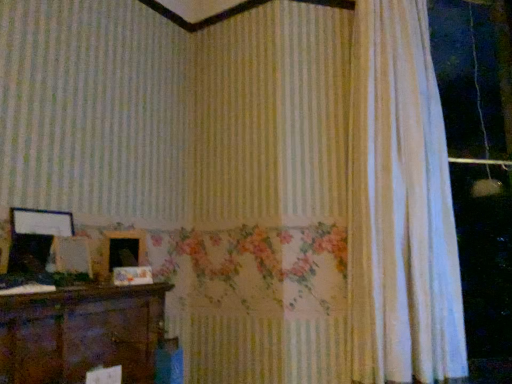
Question: Is wooden picture frame at center, positioned as the 2th picture frame in left-to-right order, not inside white sheer curtain at right?

Choices:
 (A) yes
 (B) no

Answer: (A)

Question: From the image's perspective, is wooden picture frame at center, the 1th picture frame from the right, located beneath white sheer curtain at right?

Choices:
 (A) no
 (B) yes

Answer: (B)

Question: Is wooden picture frame at center, positioned as the 2th picture frame in left-to-right order, positioned in front of white sheer curtain at right?

Choices:
 (A) no
 (B) yes

Answer: (B)

Question: Does wooden picture frame at center, positioned as the 2th picture frame in left-to-right order, have a smaller size compared to white sheer curtain at right?

Choices:
 (A) yes
 (B) no

Answer: (A)

Question: Could you tell me if wooden picture frame at center, the 1th picture frame from the right, is facing white sheer curtain at right?

Choices:
 (A) no
 (B) yes

Answer: (A)

Question: Is wooden picture frame at center, the 1th picture frame from the right, shorter than white sheer curtain at right?

Choices:
 (A) no
 (B) yes

Answer: (B)

Question: Is wooden picture frame at left, which appears as the 2th picture frame when viewed from the right, looking in the opposite direction of white sheer curtain at right?

Choices:
 (A) no
 (B) yes

Answer: (A)

Question: Does wooden picture frame at left, acting as the 1th picture frame starting from the left, have a lesser width compared to white sheer curtain at right?

Choices:
 (A) no
 (B) yes

Answer: (B)

Question: Is wooden picture frame at left, acting as the 1th picture frame starting from the left, in front of white sheer curtain at right?

Choices:
 (A) no
 (B) yes

Answer: (B)

Question: Is wooden picture frame at left, acting as the 1th picture frame starting from the left, next to white sheer curtain at right?

Choices:
 (A) no
 (B) yes

Answer: (A)

Question: Are wooden picture frame at left, which appears as the 2th picture frame when viewed from the right, and white sheer curtain at right located far from each other?

Choices:
 (A) yes
 (B) no

Answer: (A)

Question: Considering the relative positions of wooden picture frame at left, which appears as the 2th picture frame when viewed from the right, and white sheer curtain at right in the image provided, is wooden picture frame at left, which appears as the 2th picture frame when viewed from the right, to the left of white sheer curtain at right from the viewer's perspective?

Choices:
 (A) no
 (B) yes

Answer: (B)

Question: Considering the relative positions of wooden picture frame at left, which appears as the 2th picture frame when viewed from the right, and wooden picture frame at center, positioned as the 2th picture frame in left-to-right order, in the image provided, is wooden picture frame at left, which appears as the 2th picture frame when viewed from the right, to the right of wooden picture frame at center, positioned as the 2th picture frame in left-to-right order, from the viewer's perspective?

Choices:
 (A) yes
 (B) no

Answer: (B)